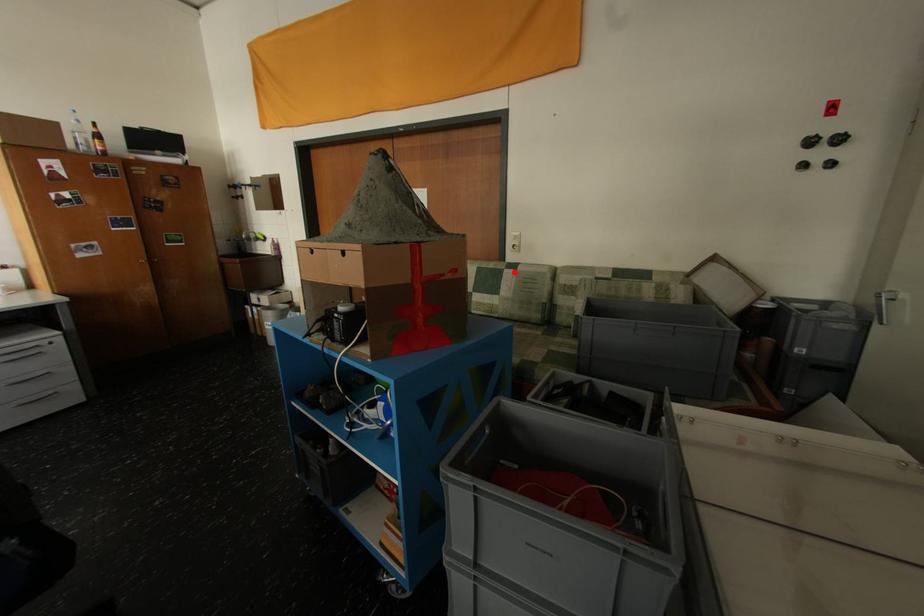
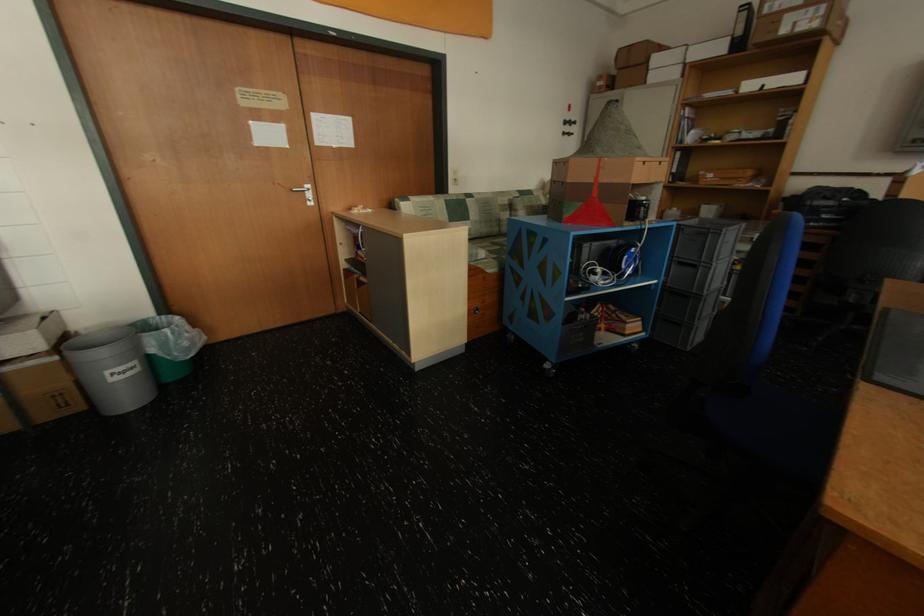
Question: I am providing you with two images of the same scene from different viewpoints. A red point is shown in image1. For the corresponding object point in image2, is it positioned nearer or farther from the camera?

Choices:
 (A) Nearer
 (B) Farther

Answer: (A)